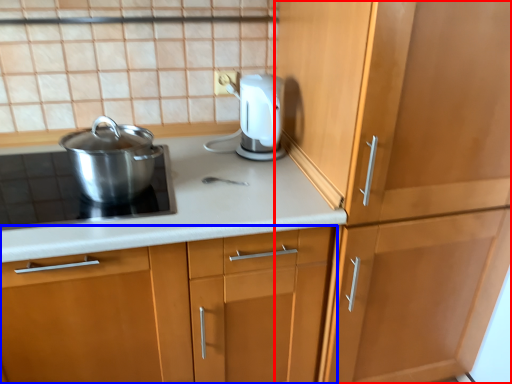
Question: Which point is further to the camera, cabinetry (highlighted by a red box) or cabinetry (highlighted by a blue box)?

Choices:
 (A) cabinetry
 (B) cabinetry

Answer: (B)